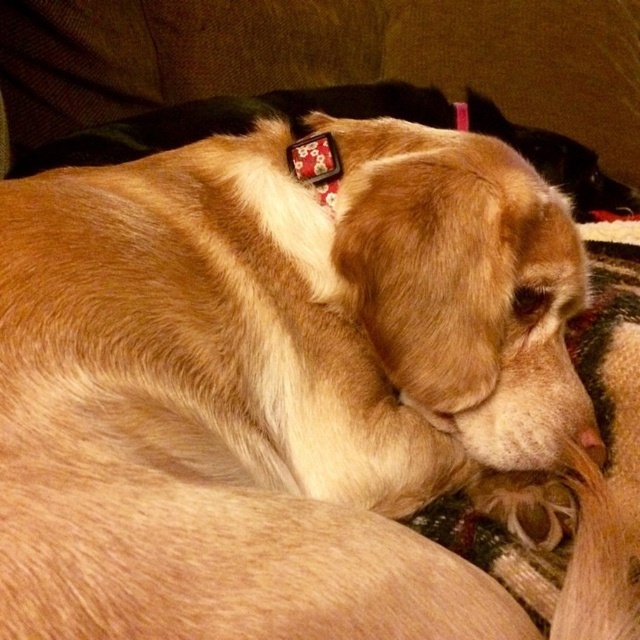
You are holding a 1.20 meter long stick and want to point it towards the point at coordinates point [637,236]. Can you reach the point with your stick?

The distance of point [637,236] from camera is 1.30 meters, so the stick of 1.20 meters is shorter than the required distance. You cannot reach the point with your stick.

Consider the image. You are a dog owner who wants to place a new toy between the fuzzy fabric dog bed at center and the floral fabric collar at upper center. The toy requires 16 inches of space. Do you think there is enough space between them?

The fuzzy fabric dog bed at center is 16.62 inches away from the floral fabric collar at upper center, so yes, there is enough space to place the toy between them since the distance is slightly more than the required 16 inches.

Based on the scene description, can you determine if the fuzzy fabric dog bed at center is supporting the floral fabric collar at upper center?

The fuzzy fabric dog bed at center is positioned under the floral fabric collar at upper center, so yes, the bed is supporting the collar.